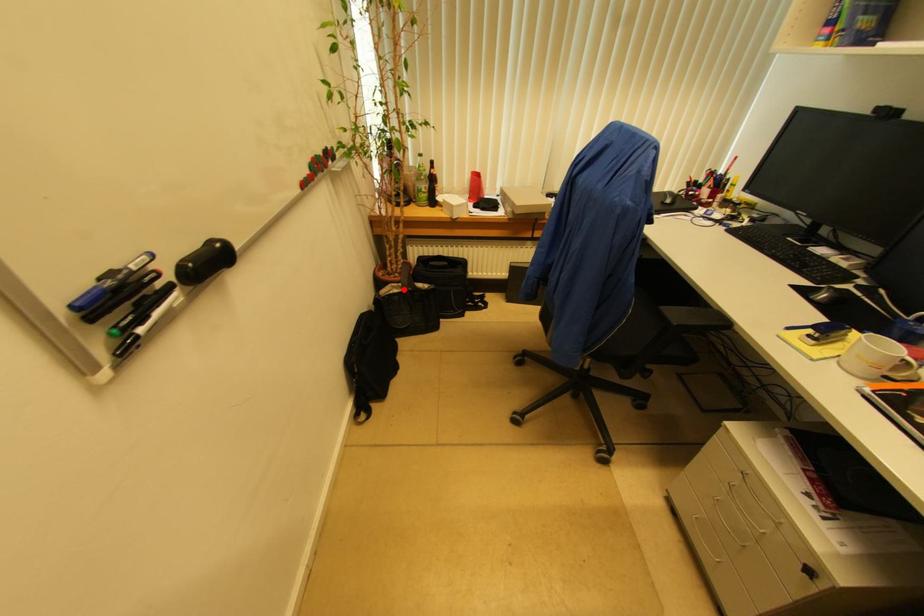
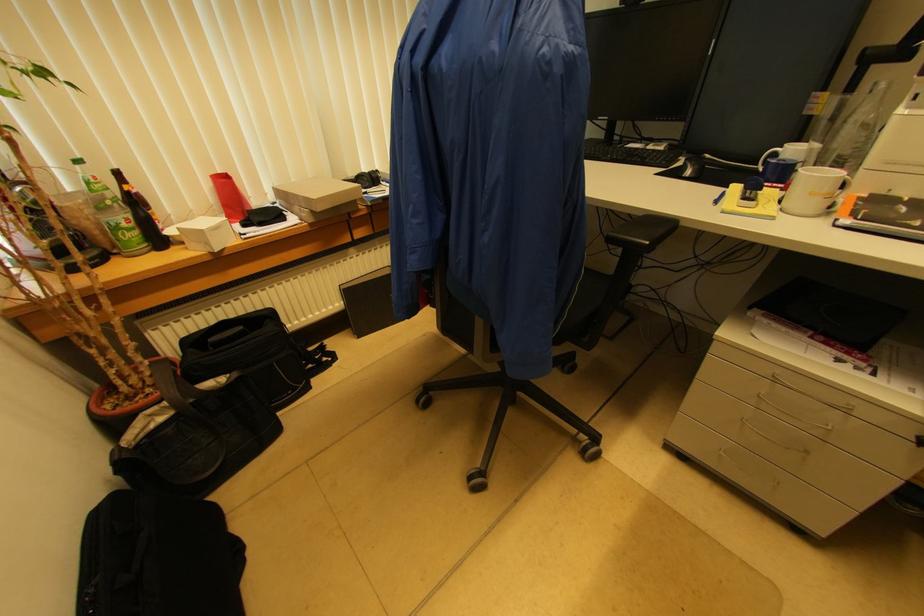
Find the pixel in the second image that matches the highlighted location in the first image.

(175, 408)